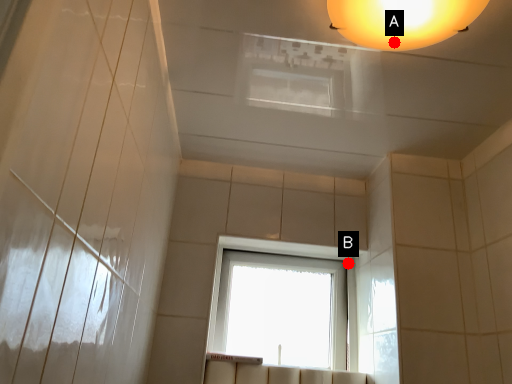
Question: Two points are circled on the image, labeled by A and B beside each circle. Which point appears closest to the camera in this image?

Choices:
 (A) A is closer
 (B) B is closer

Answer: (A)